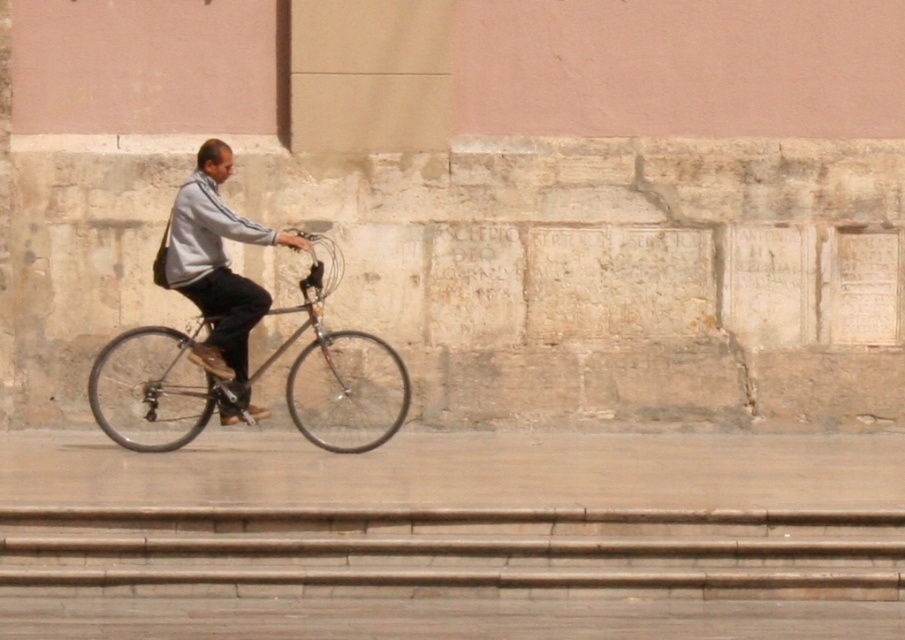
Identify the location of shiny black bicycle at center. The image size is (905, 640). (252, 380).

Is shiny black bicycle at center closer to camera compared to light gray fabric jacket at center?

Yes, it is.

Is point (160, 349) closer to viewer compared to point (207, 250)?

No, (160, 349) is behind (207, 250).

The height and width of the screenshot is (640, 905). I want to click on shiny black bicycle at center, so click(252, 380).